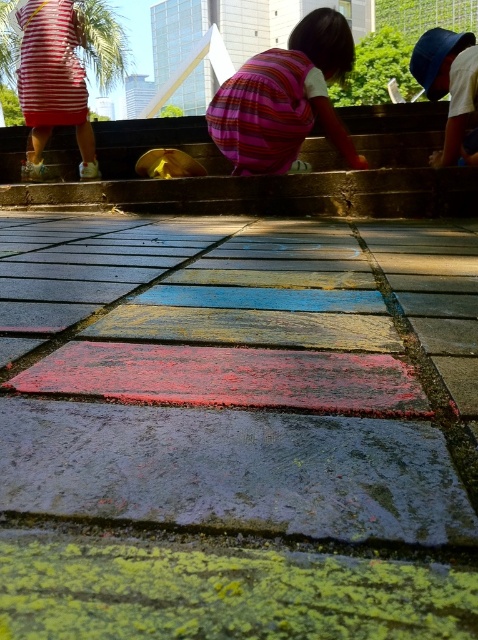
Is painted concrete pavement at center below blue plastic bucket at upper center?

Yes.

Who is positioned more to the right, painted concrete pavement at center or blue plastic bucket at upper center?

blue plastic bucket at upper center

What do you see at coordinates (237, 428) in the screenshot?
I see `painted concrete pavement at center` at bounding box center [237, 428].

The width and height of the screenshot is (478, 640). I want to click on painted concrete pavement at center, so click(237, 428).

Consider the image. Is striped fabric dress at upper left taller than blue plastic bucket at upper center?

Yes.

Which is in front, point (34, 168) or point (458, 65)?

Point (458, 65) is more forward.

This screenshot has width=478, height=640. What are the coordinates of `striped fabric dress at upper left` in the screenshot? It's located at (53, 81).

Is painted concrete pavement at center in front of striped fabric dress at upper left?

Yes, painted concrete pavement at center is closer to the viewer.

Looking at this image, does painted concrete pavement at center appear over striped fabric dress at upper left?

Actually, painted concrete pavement at center is below striped fabric dress at upper left.

Between point (367, 280) and point (37, 1), which one is positioned behind?

The point (37, 1) is more distant.

At what (x,y) coordinates should I click in order to perform the action: click on painted concrete pavement at center. Please return your answer as a coordinate pair (x, y). This screenshot has height=640, width=478. Looking at the image, I should click on (237, 428).